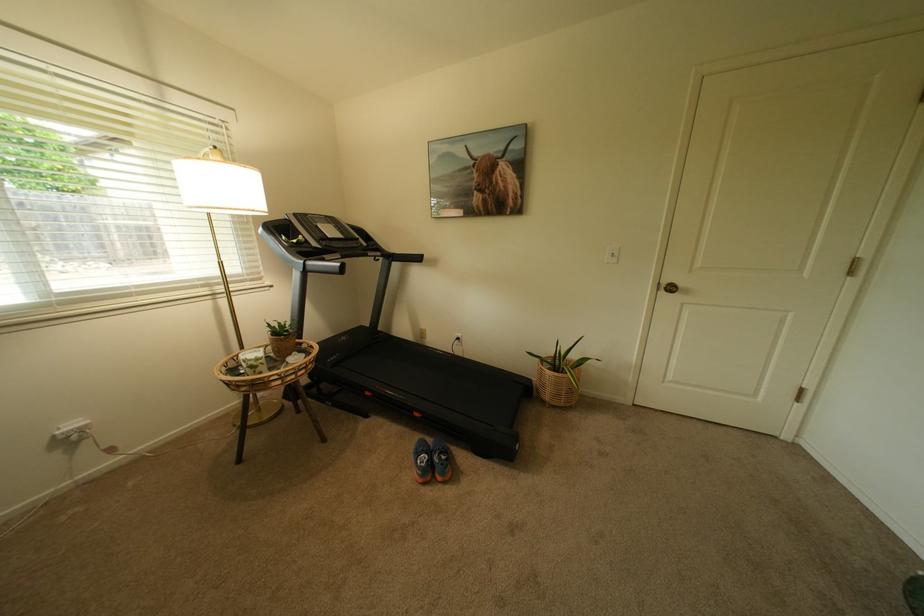
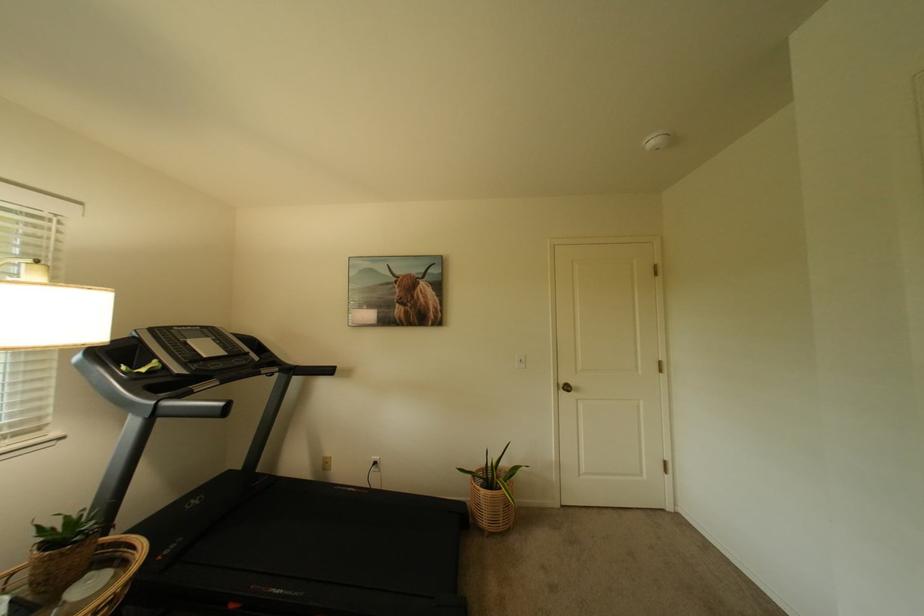
Find the pixel in the second image that matches the point at 334,261 in the first image.

(203, 392)